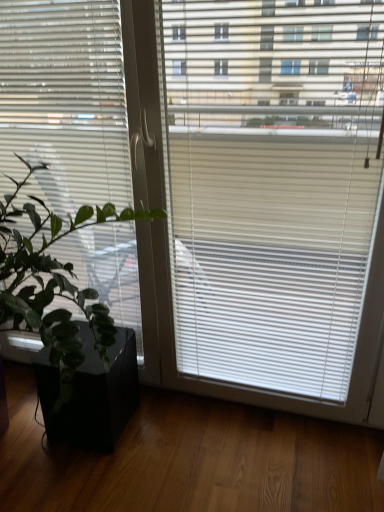
Question: Considering the relative positions of green matte plant at left and white matte window blind at left in the image provided, is green matte plant at left to the left or to the right of white matte window blind at left?

Choices:
 (A) left
 (B) right

Answer: (A)

Question: From the image's perspective, relative to white matte window blind at left, is green matte plant at left above or below?

Choices:
 (A) above
 (B) below

Answer: (B)

Question: Which is nearer to the white matte window blind at left?

Choices:
 (A) black matte flowerpot at lower left
 (B) green matte plant at left

Answer: (B)

Question: Considering the real-world distances, which object is farthest from the white matte window blind at left?

Choices:
 (A) green matte plant at left
 (B) black matte flowerpot at lower left

Answer: (B)